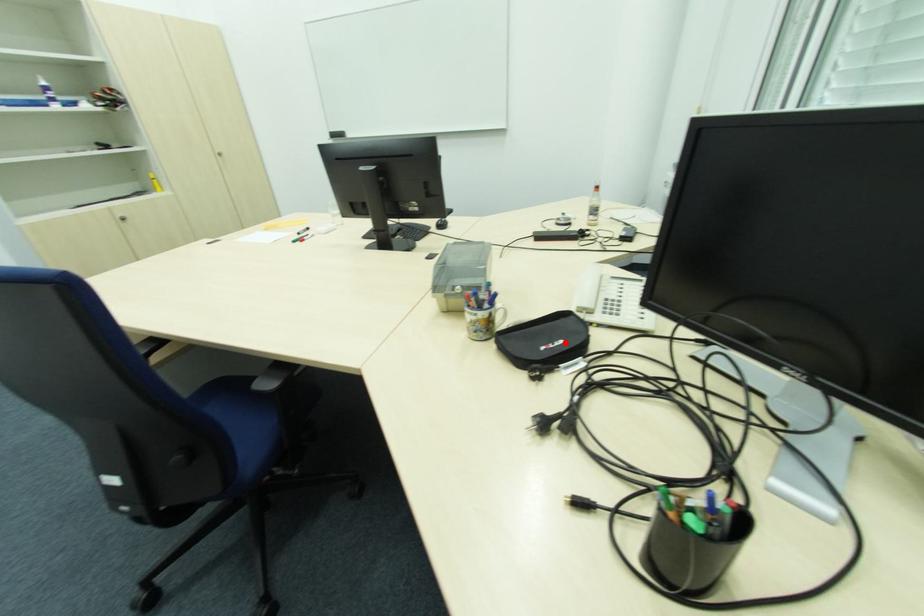
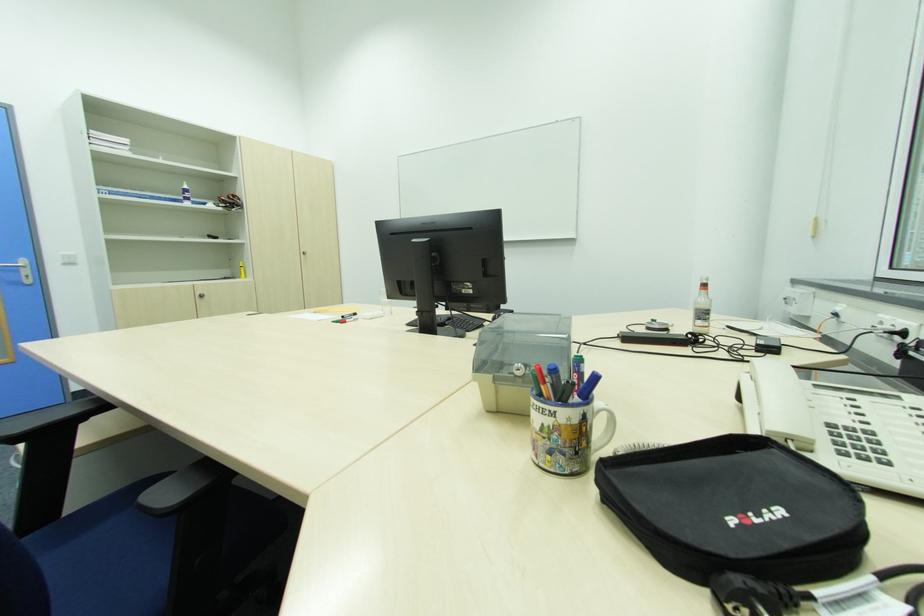
In the second image, find the point that corresponds to the highlighted location in the first image.

(783, 513)